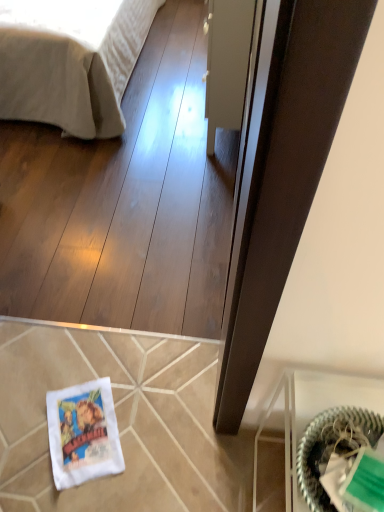
Question: Is green woven basket at lower right taller than transparent glass door at center?

Choices:
 (A) yes
 (B) no

Answer: (B)

Question: Can you confirm if green woven basket at lower right is bigger than transparent glass door at center?

Choices:
 (A) no
 (B) yes

Answer: (A)

Question: Is transparent glass door at center located within green woven basket at lower right?

Choices:
 (A) yes
 (B) no

Answer: (B)

Question: From a real-world perspective, does green woven basket at lower right stand above transparent glass door at center?

Choices:
 (A) yes
 (B) no

Answer: (A)

Question: Considering the relative sizes of green woven basket at lower right and transparent glass door at center in the image provided, is green woven basket at lower right wider than transparent glass door at center?

Choices:
 (A) yes
 (B) no

Answer: (B)

Question: Can you confirm if green woven basket at lower right is positioned to the right of transparent glass door at center?

Choices:
 (A) no
 (B) yes

Answer: (B)

Question: Does beige cotton bed at upper left have a greater height compared to transparent glass door at center?

Choices:
 (A) yes
 (B) no

Answer: (B)

Question: Is beige cotton bed at upper left far from transparent glass door at center?

Choices:
 (A) no
 (B) yes

Answer: (A)

Question: Is beige cotton bed at upper left aimed at transparent glass door at center?

Choices:
 (A) yes
 (B) no

Answer: (A)

Question: Is beige cotton bed at upper left to the right of transparent glass door at center from the viewer's perspective?

Choices:
 (A) yes
 (B) no

Answer: (B)

Question: Does beige cotton bed at upper left have a smaller size compared to transparent glass door at center?

Choices:
 (A) no
 (B) yes

Answer: (A)

Question: Can you confirm if beige cotton bed at upper left is thinner than transparent glass door at center?

Choices:
 (A) no
 (B) yes

Answer: (A)

Question: Considering the relative sizes of beige cotton bed at upper left and green woven basket at lower right in the image provided, is beige cotton bed at upper left bigger than green woven basket at lower right?

Choices:
 (A) yes
 (B) no

Answer: (A)